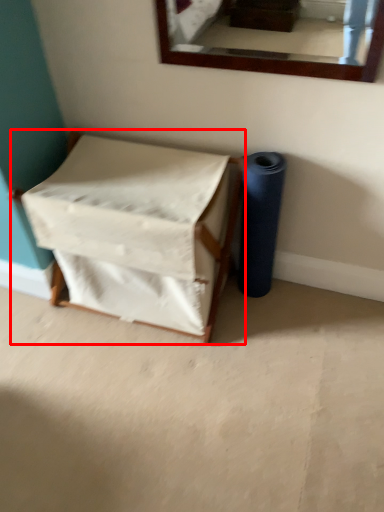
Question: From the image, what is the correct spatial relationship of furniture (annotated by the red box) in relation to toilet paper?

Choices:
 (A) right
 (B) left

Answer: (B)